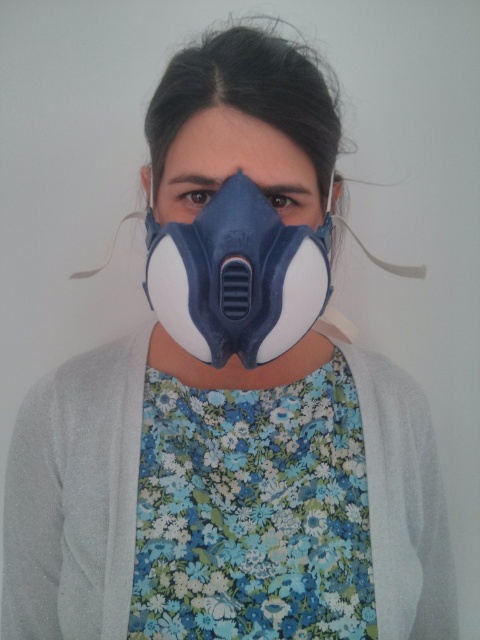
Please identify the coordinates of the object labeled as the matte blue white mask at center in the image. The coordinates should be provided in the format of a point with two decimal places. The available objects are point (237,276).

The coordinates of the matte blue white mask at center are point (237,276).